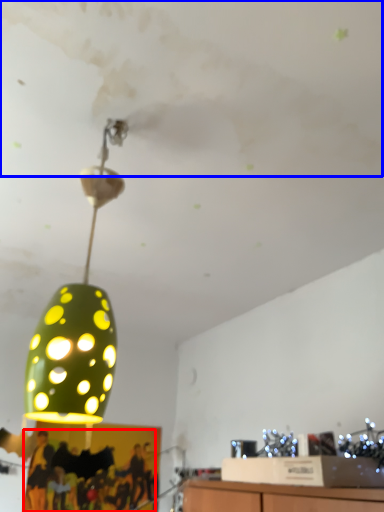
Question: Which of the following is the closest to the observer, person (highlighted by a red box) or cloud (highlighted by a blue box)?

Choices:
 (A) person
 (B) cloud

Answer: (B)